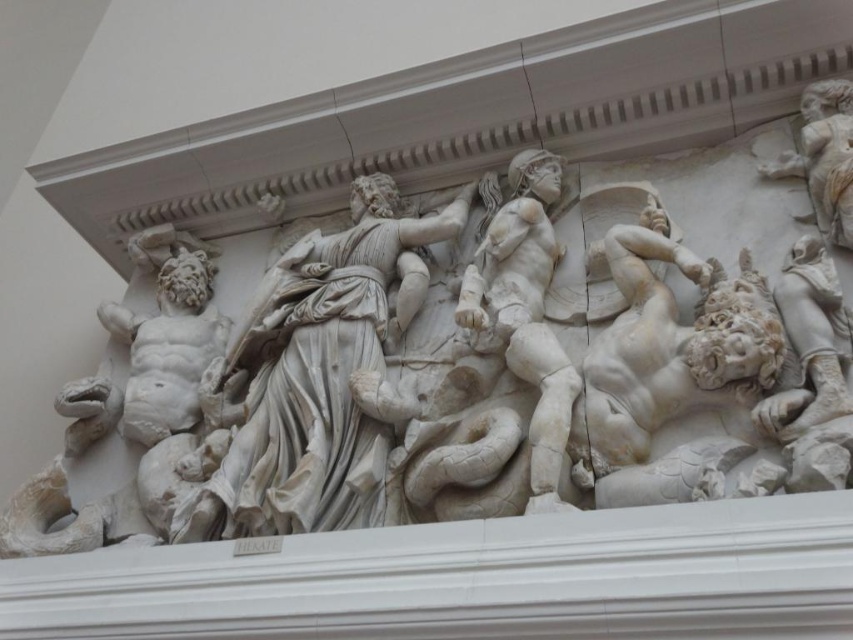
Question: Which of these objects is positioned closest to the white marble statue at center?

Choices:
 (A) white marble figure at left
 (B) white marble sculpture at center
 (C) white marble warrior at center
 (D) white marble figure at right

Answer: (B)

Question: Which point is farther to the camera?

Choices:
 (A) (166, 417)
 (B) (563, 403)
 (C) (624, 273)
 (D) (350, 264)

Answer: (A)

Question: Does white marble statue at center appear over white marble figure at right?

Choices:
 (A) no
 (B) yes

Answer: (B)

Question: Can you confirm if white marble statue at center is positioned below white marble figure at right?

Choices:
 (A) no
 (B) yes

Answer: (A)

Question: Is white marble sculpture at center above white marble figure at right?

Choices:
 (A) yes
 (B) no

Answer: (A)

Question: Which point appears farthest from the camera in this image?

Choices:
 (A) (548, 387)
 (B) (677, 403)
 (C) (822, 204)

Answer: (C)